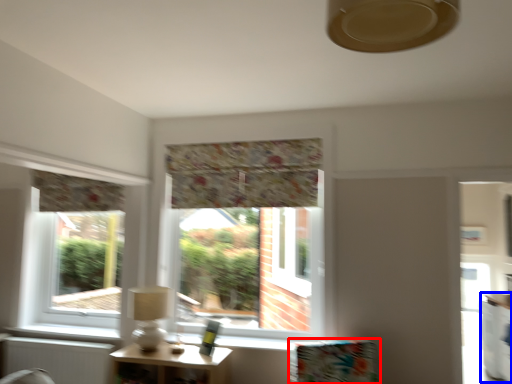
Question: Which object is closer to the camera taking this photo, furniture (highlighted by a red box) or counter (highlighted by a blue box)?

Choices:
 (A) furniture
 (B) counter

Answer: (A)